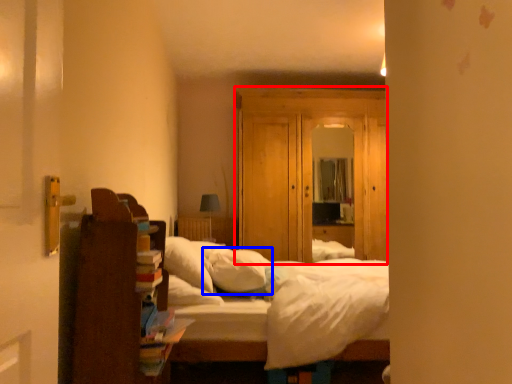
Question: Which object is further to the camera taking this photo, dresser (highlighted by a red box) or pillow (highlighted by a blue box)?

Choices:
 (A) dresser
 (B) pillow

Answer: (A)